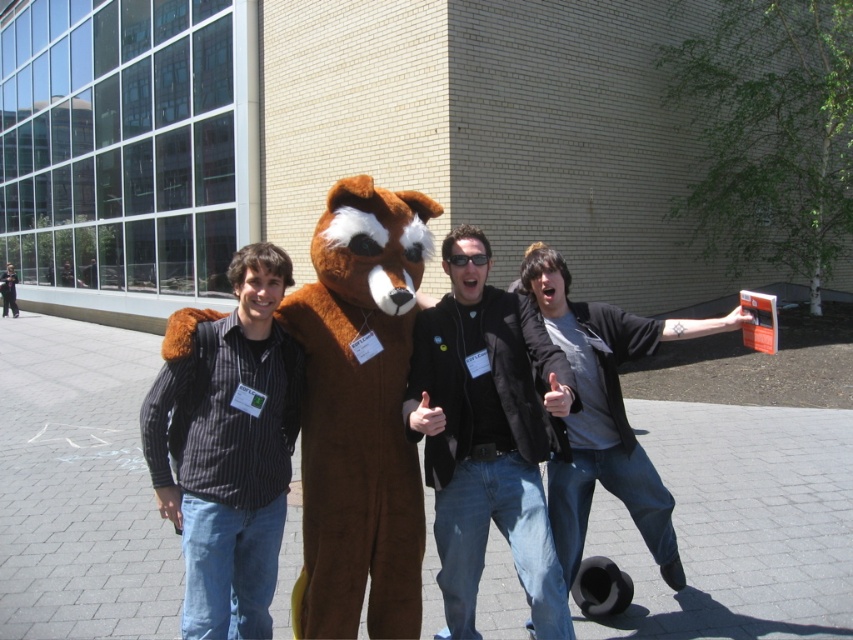
You are a photographer trying to capture a group photo of the brown furry mascot at center and the striped shirt at left. To ensure both subjects are in focus, you need to know their heights. Which one is taller?

The brown furry mascot at center is taller than the striped shirt at left.

You are a photographer trying to capture a clear shot of both the black leather jacket at center and the black plastic goggles at center. Since both are at the center, which one is more to the right?

The black leather jacket at center is positioned on the right side of black plastic goggles at center, so the black leather jacket at center is more to the right.